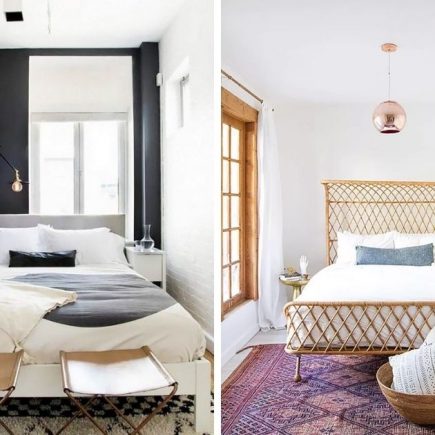
The width and height of the screenshot is (435, 435). In order to click on black and white checkered rug in this screenshot , I will do `click(58, 408)`.